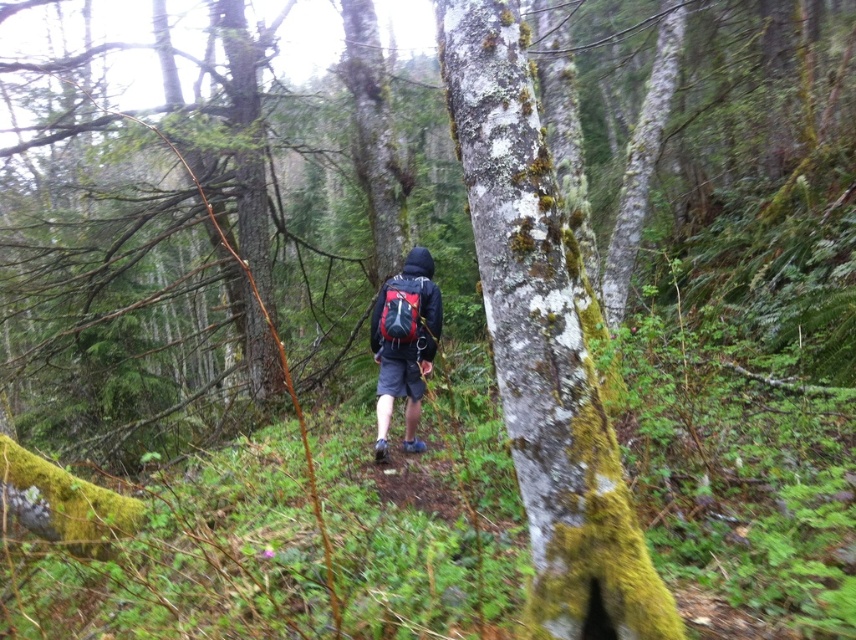
Who is more distant from viewer, [545,160] or [418,413]?

Positioned behind is point [418,413].

Does green mossy bark tree at center have a lesser height compared to matte black jacket at center?

Yes.

Which is in front, point (605, 460) or point (385, 451)?

Point (605, 460) is in front.

This screenshot has height=640, width=856. I want to click on green mossy bark tree at center, so click(542, 346).

Who is lower down, matte black jacket at center or matte black backpack at center?

matte black jacket at center is below.

Does matte black jacket at center lie in front of matte black backpack at center?

No, matte black jacket at center is behind matte black backpack at center.

Is point (421, 372) in front of point (403, 289)?

No, (421, 372) is behind (403, 289).

The image size is (856, 640). I want to click on matte black jacket at center, so click(x=403, y=342).

Does green mossy bark tree at center have a larger size compared to matte black backpack at center?

Yes.

Can you confirm if green mossy bark tree at center is shorter than matte black backpack at center?

In fact, green mossy bark tree at center may be taller than matte black backpack at center.

The height and width of the screenshot is (640, 856). In order to click on green mossy bark tree at center in this screenshot , I will do `click(542, 346)`.